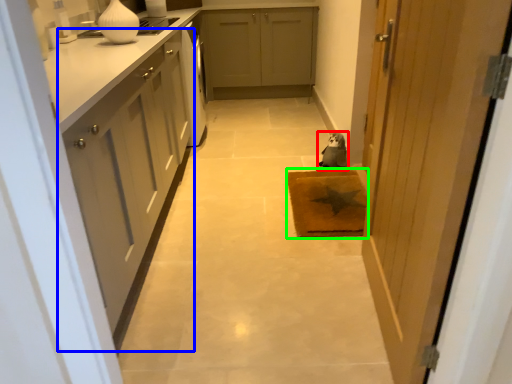
Question: Which object is the farthest from animal (highlighted by a red box)? Choose among these: cabinetry (highlighted by a blue box) or doormat (highlighted by a green box).

Choices:
 (A) cabinetry
 (B) doormat

Answer: (A)